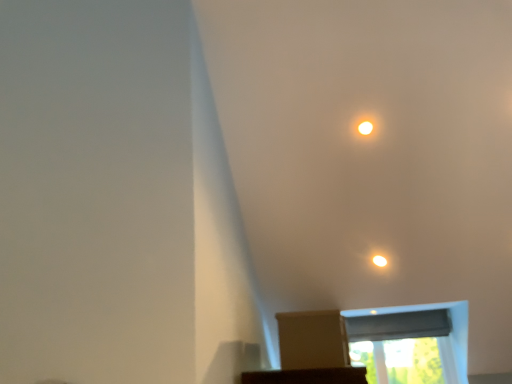
Question: Considering the relative positions of matte white light at upper center and transparent plastic window screen at upper center, arranged as the 2th window screen when viewed from the top, in the image provided, is matte white light at upper center in front of transparent plastic window screen at upper center, arranged as the 2th window screen when viewed from the top,?

Choices:
 (A) no
 (B) yes

Answer: (B)

Question: Does matte white light at upper center touch transparent plastic window screen at upper center, arranged as the 2th window screen when viewed from the top?

Choices:
 (A) yes
 (B) no

Answer: (B)

Question: Is matte white light at upper center oriented towards transparent plastic window screen at upper center, arranged as the 2th window screen when viewed from the top?

Choices:
 (A) yes
 (B) no

Answer: (B)

Question: From a real-world perspective, is matte white light at upper center located beneath transparent plastic window screen at upper center, arranged as the 2th window screen when viewed from the top?

Choices:
 (A) no
 (B) yes

Answer: (A)

Question: Is matte white light at upper center thinner than transparent plastic window screen at upper center, marked as the 1th window screen in a bottom-to-top arrangement?

Choices:
 (A) yes
 (B) no

Answer: (A)

Question: Considering the relative sizes of matte white light at upper center and transparent plastic window screen at upper center, marked as the 1th window screen in a bottom-to-top arrangement, in the image provided, is matte white light at upper center shorter than transparent plastic window screen at upper center, marked as the 1th window screen in a bottom-to-top arrangement,?

Choices:
 (A) yes
 (B) no

Answer: (A)

Question: Is matte white light at upper center shorter than brown cardboard box at center?

Choices:
 (A) no
 (B) yes

Answer: (B)

Question: Is matte white light at upper center far away from brown cardboard box at center?

Choices:
 (A) no
 (B) yes

Answer: (B)

Question: From a real-world perspective, is matte white light at upper center on brown cardboard box at center?

Choices:
 (A) yes
 (B) no

Answer: (A)

Question: Is matte white light at upper center bigger than brown cardboard box at center?

Choices:
 (A) yes
 (B) no

Answer: (B)

Question: Does matte white light at upper center have a smaller size compared to brown cardboard box at center?

Choices:
 (A) yes
 (B) no

Answer: (A)

Question: Is matte white light at upper center outside brown cardboard box at center?

Choices:
 (A) yes
 (B) no

Answer: (A)

Question: From a real-world perspective, is black fabric window screen at lower center, the second window screen when ordered from bottom to top, positioned over matte white light at upper center based on gravity?

Choices:
 (A) yes
 (B) no

Answer: (B)